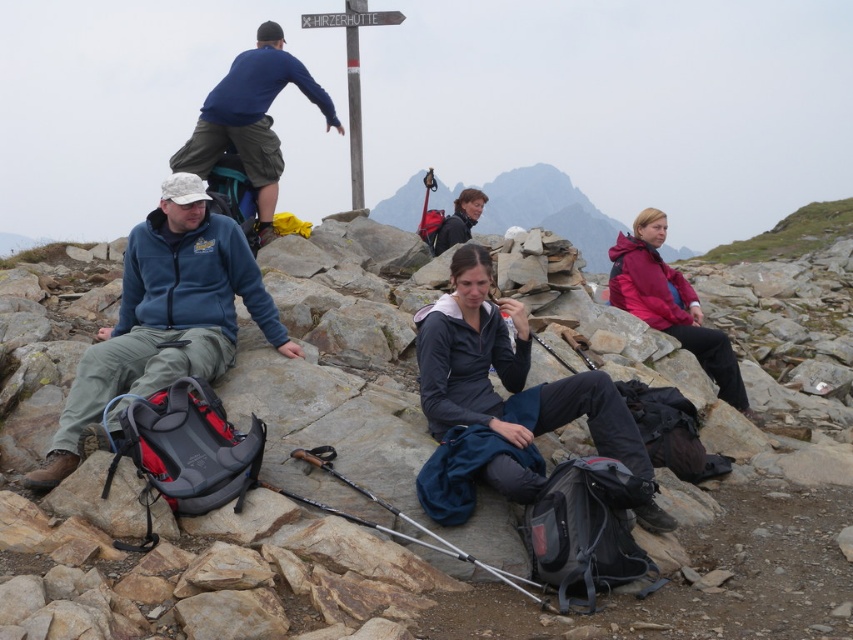
Measure the distance between point (606, 268) and camera.

Point (606, 268) is 44.67 meters from camera.

Between rocky mountain at center and matte pink jacket at right, which one is positioned lower?

matte pink jacket at right is lower down.

The image size is (853, 640). Find the location of `rocky mountain at center`. rocky mountain at center is located at coordinates (548, 211).

In order to click on rocky mountain at center in this screenshot , I will do `click(548, 211)`.

Looking at this image, measure the distance between point (53, 442) and camera.

Point (53, 442) is 14.30 feet away from camera.

Which is behind, point (146, 323) or point (257, 99)?

Point (257, 99)

Locate an element on the screen. Image resolution: width=853 pixels, height=640 pixels. blue fleece jacket at left is located at coordinates (164, 317).

Who is higher up, matte black jacket at center or rocky mountain at center?

rocky mountain at center is above.

Which is in front, point (514, 436) or point (577, 212)?

Point (514, 436)

Find the location of `matte black jacket at center`. matte black jacket at center is located at coordinates 514,378.